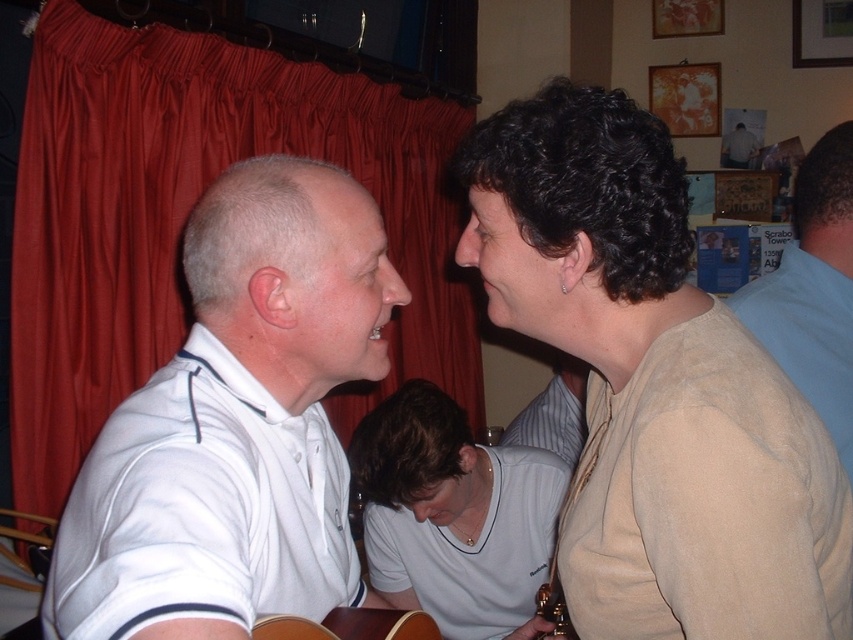
You are planning to take a photo of the beige soft sweater at upper right and the white shirt at upper center. Since you want to capture both items clearly in the frame, which one should you focus on first to ensure the wider object is properly framed?

The beige soft sweater at upper right has a greater width than the white shirt at upper center. To ensure the wider object is properly framed, you should focus on the beige soft sweater at upper right first.

You are standing in the center of the room facing the red curtain. There is a light brown wooden guitar at center. Where is the light brown wooden guitar relative to your position?

The light brown wooden guitar at center is located at point (349, 625), which means it is positioned slightly to the right and forward from your central standing position, making it easily accessible.

You are standing in the room and want to find the white matte shirt at center. According to the coordinates provided, where should you look relative to the red curtain in the background?

The white matte shirt at center is located at point coordinates (453, 515), which places it near the lower right area of the image. Since the red curtain is in the background, you should look towards the lower right direction from the curtain to find the shirt.